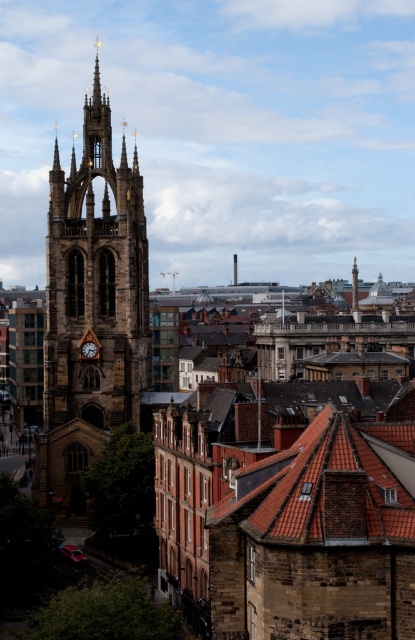
Does dark brown stone tower at center-left appear on the right side of matte brown clock at center-left?

Incorrect, dark brown stone tower at center-left is not on the right side of matte brown clock at center-left.

Is point (119, 285) in front of point (83, 349)?

Yes, point (119, 285) is closer to viewer.

Where is `dark brown stone tower at center-left`? dark brown stone tower at center-left is located at coordinates (90, 310).

Identify the location of dark brown stone tower at center-left. This screenshot has height=640, width=415. (90, 310).